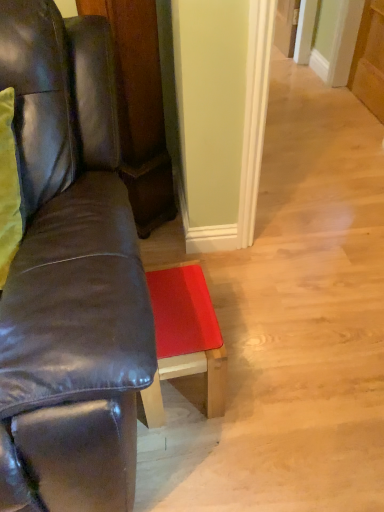
The width and height of the screenshot is (384, 512). Describe the element at coordinates (184, 340) in the screenshot. I see `smooth red table at lower right` at that location.

Where is `smooth red table at lower right`? smooth red table at lower right is located at coordinates (184, 340).

The height and width of the screenshot is (512, 384). In order to click on smooth red table at lower right in this screenshot , I will do `click(184, 340)`.